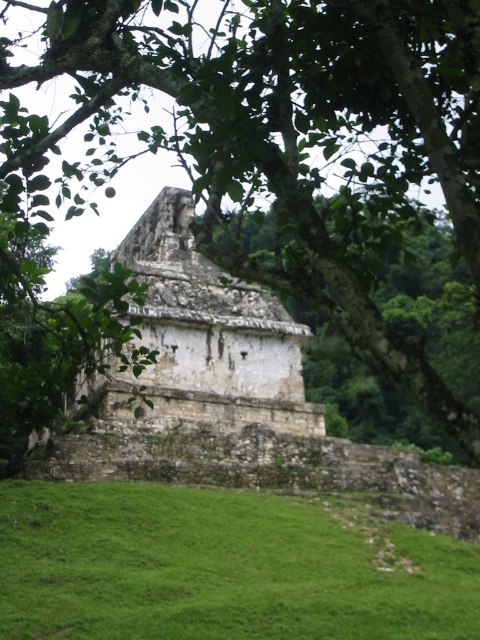
Question: Which point is farther from the camera taking this photo?

Choices:
 (A) (47, 45)
 (B) (321, 634)

Answer: (A)

Question: Which of the following is the closest to the observer?

Choices:
 (A) (279, 342)
 (B) (358, 321)
 (C) (171, 540)

Answer: (B)

Question: From the image, what is the correct spatial relationship of green leafy tree at center in relation to stone temple at center?

Choices:
 (A) left
 (B) right

Answer: (B)

Question: Which object is farther from the camera taking this photo?

Choices:
 (A) stone temple at center
 (B) green leafy tree at center
 (C) green grassy hillside at lower center

Answer: (A)

Question: Is green leafy tree at center below stone temple at center?

Choices:
 (A) no
 (B) yes

Answer: (A)

Question: Does green leafy tree at center appear on the right side of green grassy hillside at lower center?

Choices:
 (A) yes
 (B) no

Answer: (A)